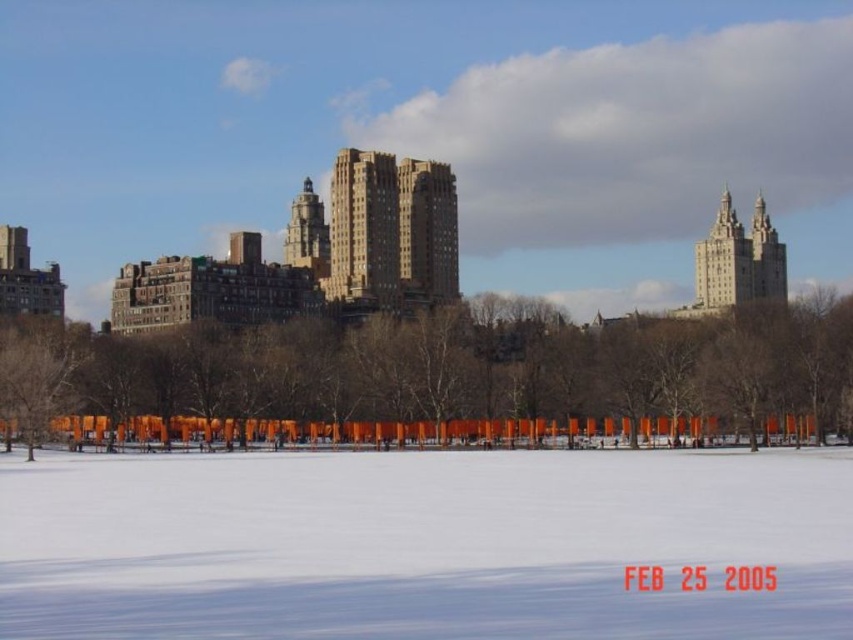
Can you confirm if matte gray building at upper right is positioned to the right of matte brown tower at center?

Correct, you'll find matte gray building at upper right to the right of matte brown tower at center.

Does point (757, 202) come in front of point (328, 266)?

No, (757, 202) is behind (328, 266).

Where is `matte gray building at upper right`? Image resolution: width=853 pixels, height=640 pixels. matte gray building at upper right is located at coordinates (738, 260).

Which is more to the left, white powdery snow at center or matte brown tower at center?

matte brown tower at center is more to the left.

Can you confirm if white powdery snow at center is smaller than matte brown tower at center?

Yes, white powdery snow at center is smaller than matte brown tower at center.

Measure the distance between point (41, 476) and camera.

They are 80.99 meters apart.

Locate an element on the screen. white powdery snow at center is located at coordinates (422, 545).

Does point (410, 228) lie in front of point (722, 257)?

Yes, it is.

Who is more forward, (350, 284) or (752, 216)?

Positioned in front is point (350, 284).

I want to click on brown stone building at center, so click(392, 230).